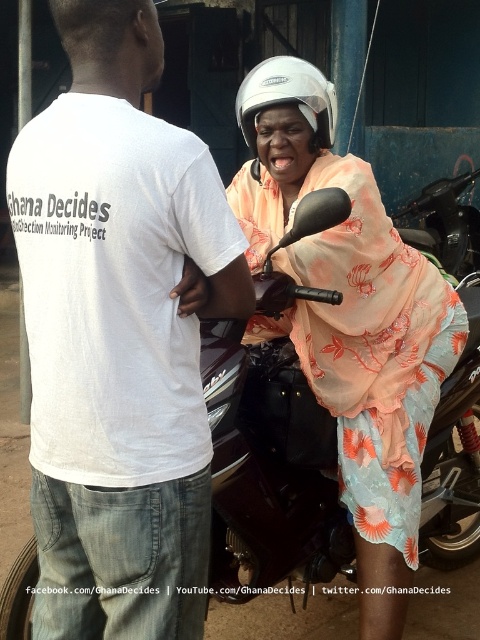
You are a photographer trying to capture a clear photo of both the white cotton shirt at center and the shiny dark brown motorcycle at center. Since you want both subjects to be in focus, which one should you focus on first?

You should focus on the white cotton shirt at center first because it is closer to the viewer than the shiny dark brown motorcycle at center, so adjusting focus from near to far will help ensure both are in focus.